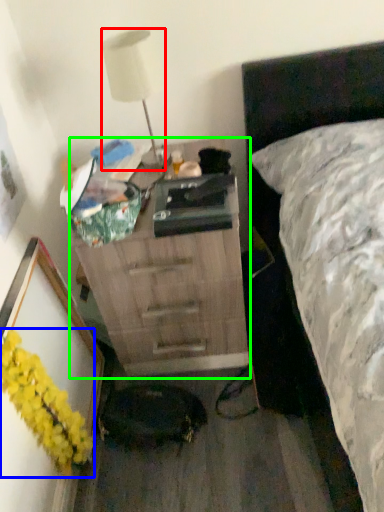
Question: Based on their relative distances, which object is nearer to lamp (highlighted by a red box)? Choose from flower (highlighted by a blue box) and chest of drawers (highlighted by a green box).

Choices:
 (A) flower
 (B) chest of drawers

Answer: (B)